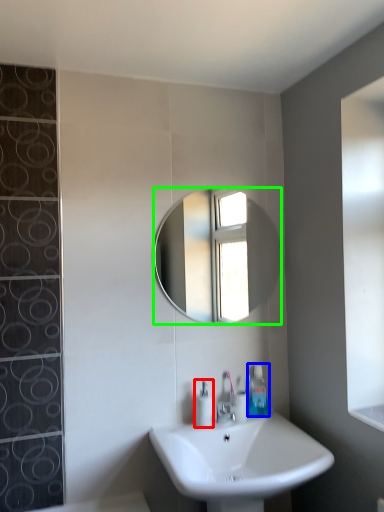
Question: Which object is the closest to the soap dispenser (highlighted by a red box)? Choose among these: toiletry (highlighted by a blue box) or mirror (highlighted by a green box).

Choices:
 (A) toiletry
 (B) mirror

Answer: (A)